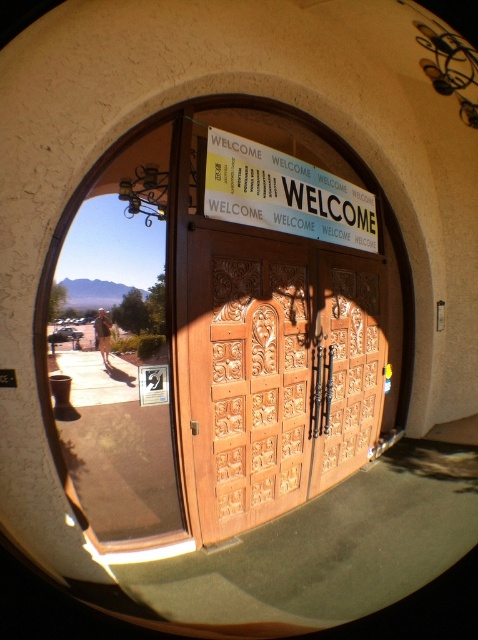
Looking at this image, which of these two, wooden carved doors at center or yellow paper sign at center, stands shorter?

yellow paper sign at center is shorter.

Describe the element at coordinates (275, 333) in the screenshot. Image resolution: width=478 pixels, height=640 pixels. I see `wooden carved doors at center` at that location.

Locate an element on the screen. The height and width of the screenshot is (640, 478). wooden carved doors at center is located at coordinates (275, 333).